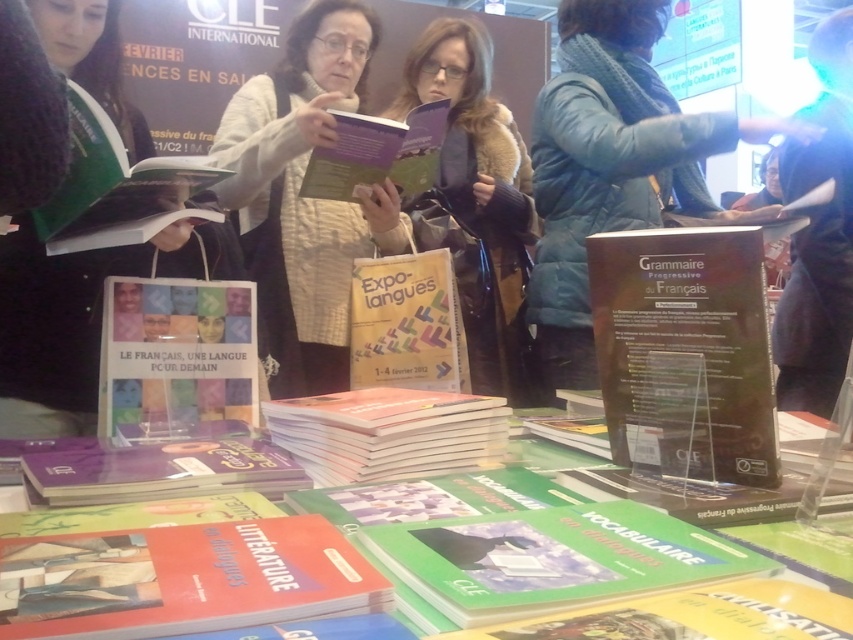
Which is above, purple matte book at lower left or purple matte book at center?

purple matte book at center is above.

Which is behind, point (187, 477) or point (396, 157)?

The point (396, 157) is more distant.

I want to click on purple matte book at lower left, so click(x=158, y=472).

Is blue puffy jacket at center taller than brown fur coat at center?

Incorrect, blue puffy jacket at center's height is not larger of brown fur coat at center's.

Which of these two, blue puffy jacket at center or brown fur coat at center, stands taller?

brown fur coat at center is taller.

Which is in front, point (762, 134) or point (451, 209)?

Point (762, 134)

Where is `blue puffy jacket at center`? blue puffy jacket at center is located at coordinates (613, 164).

Who is higher up, dark brown paperback book at center or orange matte book at center?

dark brown paperback book at center is above.

Is point (769, 410) closer to camera compared to point (374, 436)?

Yes, point (769, 410) is in front of point (374, 436).

This screenshot has height=640, width=853. Find the location of `dark brown paperback book at center`. dark brown paperback book at center is located at coordinates (685, 353).